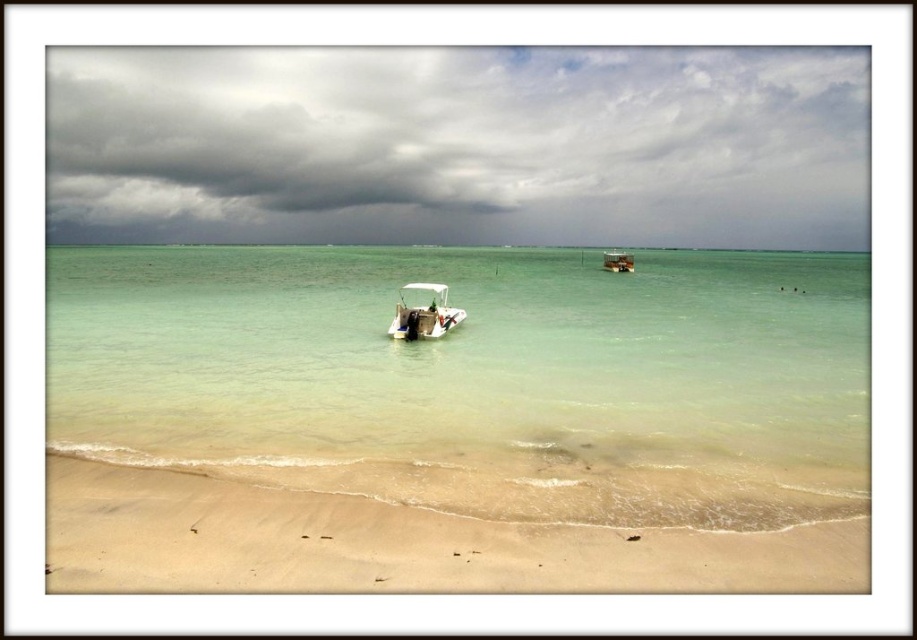
Question: Does clear water at center appear on the right side of wooden cabin boat at upper center?

Choices:
 (A) no
 (B) yes

Answer: (A)

Question: Which point is closer to the camera?

Choices:
 (A) white matte boat at center
 (B) wooden cabin boat at upper center
 (C) cloudy sky at upper center
 (D) clear water at center

Answer: (D)

Question: Is clear water at center to the right of wooden cabin boat at upper center from the viewer's perspective?

Choices:
 (A) no
 (B) yes

Answer: (A)

Question: Which of the following is the farthest from the observer?

Choices:
 (A) (622, 256)
 (B) (127, 284)
 (C) (65, 531)
 (D) (432, 317)

Answer: (A)

Question: Which point is farther to the camera?

Choices:
 (A) white matte boat at center
 (B) clear water at center
 (C) beige sandy beach at lower center

Answer: (A)

Question: Does clear water at center appear on the left side of wooden cabin boat at upper center?

Choices:
 (A) yes
 (B) no

Answer: (A)